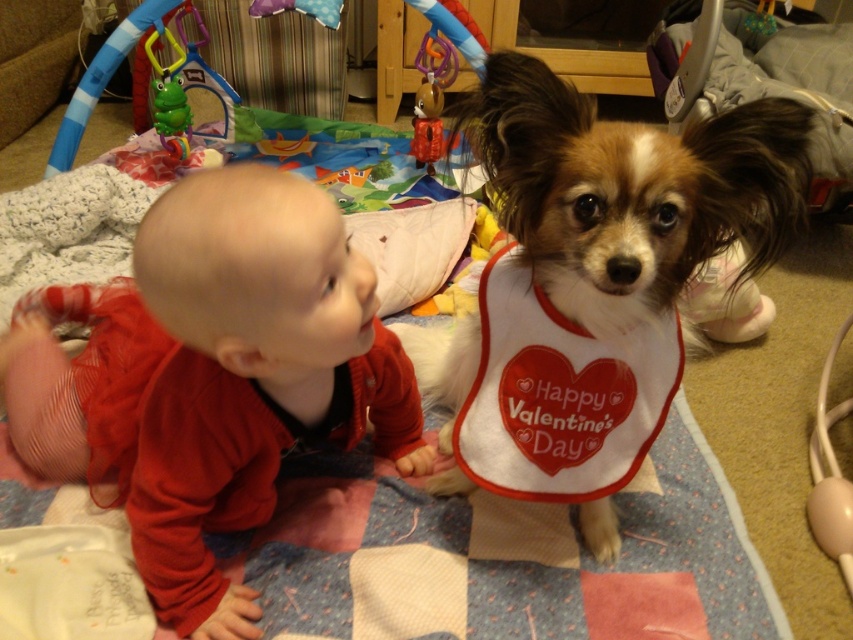
Question: Among these objects, which one is farthest from the camera?

Choices:
 (A) green rubber frog at upper left
 (B) white fabric bib at center

Answer: (A)

Question: Which point is closer to the camera?

Choices:
 (A) (460, 412)
 (B) (163, 134)
 (C) (693, 173)

Answer: (C)

Question: Is matte red sweater at left closer to the viewer compared to white fabric bib at center?

Choices:
 (A) yes
 (B) no

Answer: (A)

Question: Is brown and white fur at center positioned before green rubber frog at upper left?

Choices:
 (A) yes
 (B) no

Answer: (A)

Question: Estimate the real-world distances between objects in this image. Which object is closer to the brown and white fur at center?

Choices:
 (A) green rubber frog at upper left
 (B) white fabric bib at center
 (C) matte red sweater at left

Answer: (B)

Question: Does matte red sweater at left appear over white fabric bib at center?

Choices:
 (A) no
 (B) yes

Answer: (A)